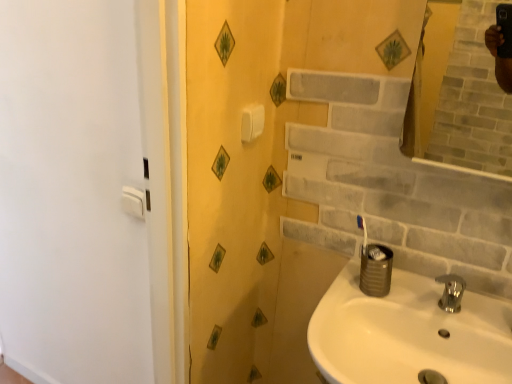
Question: Does polished chrome faucet at lower right turn towards white glossy sink at lower right?

Choices:
 (A) no
 (B) yes

Answer: (A)

Question: From a real-world perspective, is polished chrome faucet at lower right over white glossy sink at lower right?

Choices:
 (A) no
 (B) yes

Answer: (B)

Question: Are polished chrome faucet at lower right and white glossy sink at lower right making contact?

Choices:
 (A) yes
 (B) no

Answer: (B)

Question: Does polished chrome faucet at lower right appear on the right side of white glossy sink at lower right?

Choices:
 (A) no
 (B) yes

Answer: (B)

Question: Does polished chrome faucet at lower right have a lesser height compared to white glossy sink at lower right?

Choices:
 (A) yes
 (B) no

Answer: (A)

Question: Is polished chrome faucet at lower right positioned beyond the bounds of white glossy sink at lower right?

Choices:
 (A) yes
 (B) no

Answer: (A)

Question: Is white glossy sink at lower right not near polished chrome faucet at lower right?

Choices:
 (A) yes
 (B) no

Answer: (B)

Question: Could you tell me if white glossy sink at lower right is turned towards polished chrome faucet at lower right?

Choices:
 (A) yes
 (B) no

Answer: (B)

Question: Considering the relative sizes of white glossy sink at lower right and polished chrome faucet at lower right in the image provided, is white glossy sink at lower right wider than polished chrome faucet at lower right?

Choices:
 (A) no
 (B) yes

Answer: (B)

Question: Is white glossy sink at lower right not inside polished chrome faucet at lower right?

Choices:
 (A) no
 (B) yes

Answer: (B)

Question: Is white glossy sink at lower right positioned behind polished chrome faucet at lower right?

Choices:
 (A) yes
 (B) no

Answer: (B)

Question: From a real-world perspective, is white glossy sink at lower right located higher than polished chrome faucet at lower right?

Choices:
 (A) no
 (B) yes

Answer: (A)

Question: Considering their positions, is white glossy sink at lower right located in front of or behind polished chrome faucet at lower right?

Choices:
 (A) behind
 (B) front

Answer: (B)